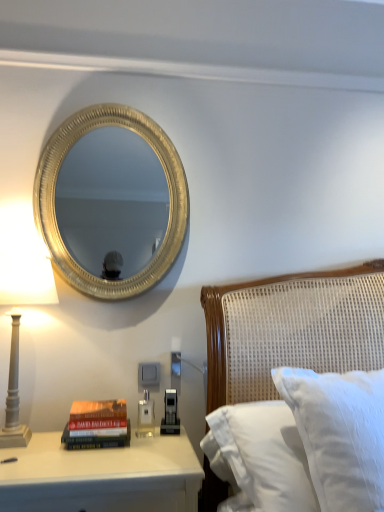
The width and height of the screenshot is (384, 512). I want to click on free space in front of hardcover book at lower left, so click(102, 463).